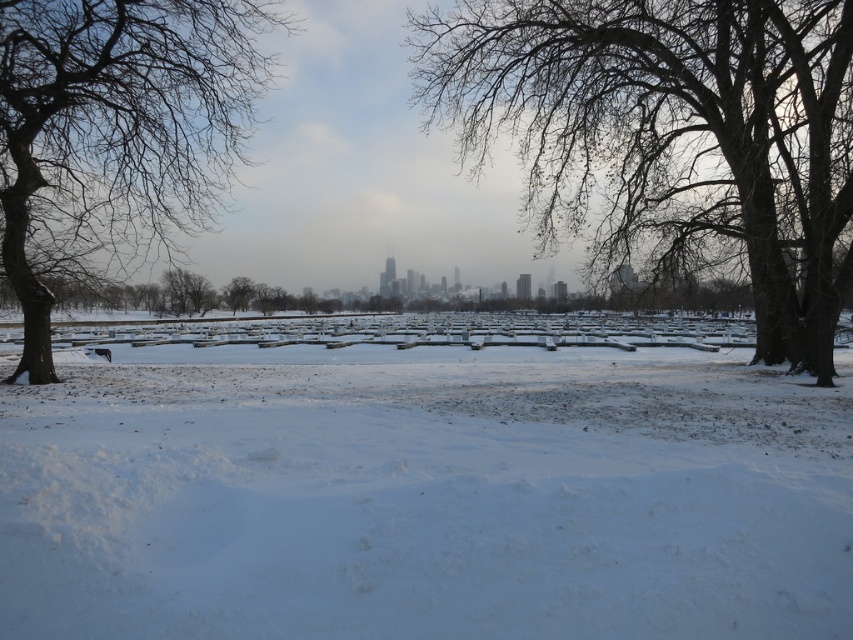
Question: Can you confirm if white fluffy snow at center is positioned above bare wood tree at left?

Choices:
 (A) yes
 (B) no

Answer: (B)

Question: Can you confirm if white fluffy snow at center is smaller than bare branches at center?

Choices:
 (A) no
 (B) yes

Answer: (B)

Question: Which object appears farthest from the camera in this image?

Choices:
 (A) brown textured tree at center
 (B) bare wood tree at left

Answer: (A)

Question: Estimate the real-world distances between objects in this image. Which object is closer to the bare branches at center?

Choices:
 (A) bare wood tree at center
 (B) brown textured tree at center
 (C) bare wood tree at left
 (D) white fluffy snow at center

Answer: (B)

Question: Can you confirm if white fluffy snow at center is positioned to the left of bare branches at center?

Choices:
 (A) no
 (B) yes

Answer: (A)

Question: Which of the following is the farthest from the observer?

Choices:
 (A) (6, 240)
 (B) (421, 547)

Answer: (A)